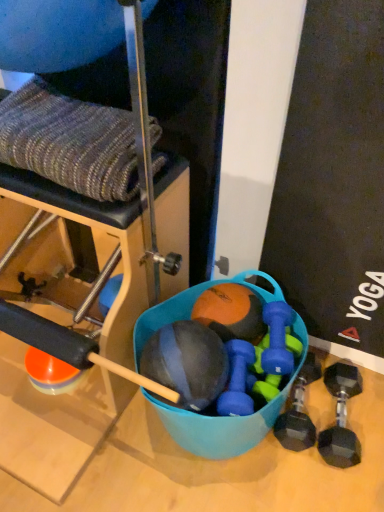
Question: Is blue rubber dumbbell at center, which ranks as the second dumbbell in left-to-right order, at the left side of knitted fabric at upper left?

Choices:
 (A) no
 (B) yes

Answer: (A)

Question: Is blue rubber dumbbell at center, marked as the 3th dumbbell in a right-to-left arrangement, thinner than knitted fabric at upper left?

Choices:
 (A) no
 (B) yes

Answer: (A)

Question: Is knitted fabric at upper left at the back of blue rubber dumbbell at center, which ranks as the second dumbbell in left-to-right order?

Choices:
 (A) no
 (B) yes

Answer: (A)

Question: Is knitted fabric at upper left located within blue rubber dumbbell at center, which ranks as the second dumbbell in left-to-right order?

Choices:
 (A) no
 (B) yes

Answer: (A)

Question: From the image's perspective, is blue rubber dumbbell at center, which ranks as the second dumbbell in left-to-right order, located above knitted fabric at upper left?

Choices:
 (A) yes
 (B) no

Answer: (B)

Question: Does blue rubber dumbbell at center, which ranks as the second dumbbell in left-to-right order, come behind knitted fabric at upper left?

Choices:
 (A) yes
 (B) no

Answer: (A)

Question: Is black rubber dumbbell at lower right, the 1th dumbbell positioned from the right, behind knitted fabric at upper left?

Choices:
 (A) no
 (B) yes

Answer: (B)

Question: Considering the relative positions of black rubber dumbbell at lower right, positioned as the 4th dumbbell in left-to-right order, and knitted fabric at upper left in the image provided, is black rubber dumbbell at lower right, positioned as the 4th dumbbell in left-to-right order, to the right of knitted fabric at upper left from the viewer's perspective?

Choices:
 (A) yes
 (B) no

Answer: (A)

Question: Does black rubber dumbbell at lower right, positioned as the 4th dumbbell in left-to-right order, have a smaller size compared to knitted fabric at upper left?

Choices:
 (A) yes
 (B) no

Answer: (A)

Question: Is black rubber dumbbell at lower right, the 1th dumbbell positioned from the right, taller than knitted fabric at upper left?

Choices:
 (A) yes
 (B) no

Answer: (B)

Question: Can you confirm if black rubber dumbbell at lower right, the 1th dumbbell positioned from the right, is bigger than knitted fabric at upper left?

Choices:
 (A) no
 (B) yes

Answer: (A)

Question: Is black rubber dumbbell at lower right, positioned as the 4th dumbbell in left-to-right order, thinner than knitted fabric at upper left?

Choices:
 (A) no
 (B) yes

Answer: (A)

Question: Are knitted fabric at upper left and blue rubber bucket at center located far from each other?

Choices:
 (A) yes
 (B) no

Answer: (B)